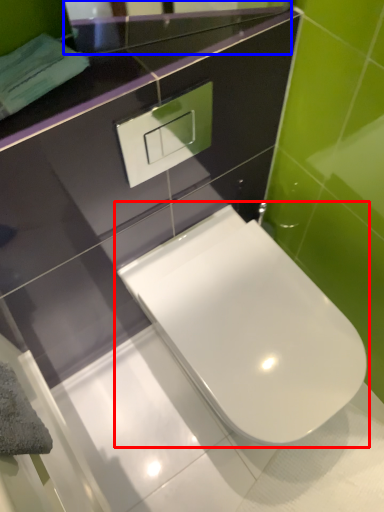
Question: Which object appears closest to the camera in this image, toilet (highlighted by a red box) or mirror (highlighted by a blue box)?

Choices:
 (A) toilet
 (B) mirror

Answer: (B)